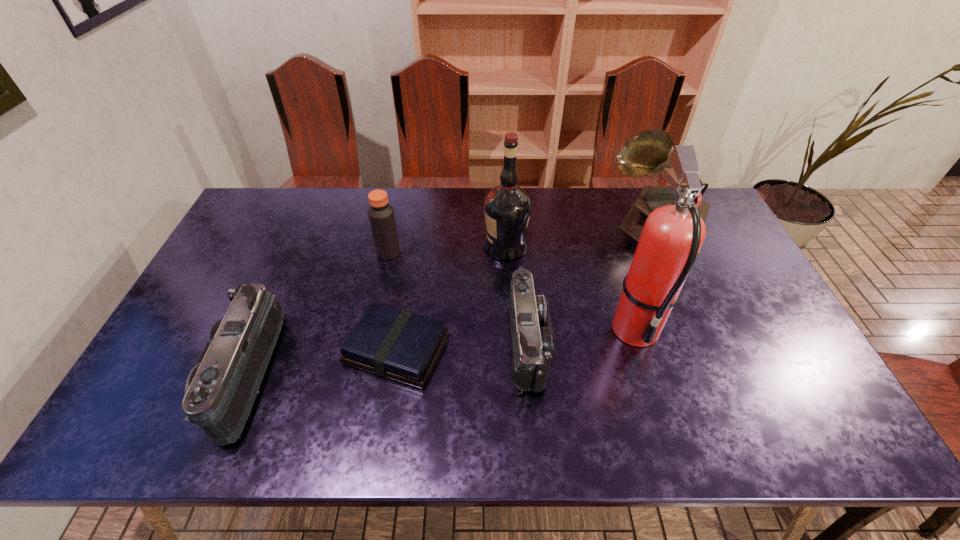
The height and width of the screenshot is (540, 960). I want to click on blank region between the liquor and the vinegar, so click(447, 249).

The width and height of the screenshot is (960, 540). In order to click on vacant space that is in between the shorter camcorder and the book in this screenshot , I will do `click(462, 347)`.

Identify the location of vacant point located between the vinegar and the taller camcorder. The image size is (960, 540). pos(318,314).

You are a GUI agent. You are given a task and a screenshot of the screen. Output one action in this format:
    pyautogui.click(x=<x>, y=<y>)
    Task: Click on the vacant space that's between the shortest object and the third shortest object
    
    Given the screenshot: What is the action you would take?
    pyautogui.click(x=322, y=362)

Locate an element on the screen. free spot between the right camcorder and the phonograph record is located at coordinates (591, 284).

The width and height of the screenshot is (960, 540). Find the location of `the second closest object relative to the phonograph record`. the second closest object relative to the phonograph record is located at coordinates (507, 207).

The height and width of the screenshot is (540, 960). What are the coordinates of `the closest object relative to the tallest object` in the screenshot? It's located at (648, 153).

Locate an element on the screen. vacant space that satisfies the following two spatial constraints: 1. on the horn direction of the phonograph record; 2. on the hose direction of the tallest object is located at coordinates (701, 327).

This screenshot has width=960, height=540. I want to click on free location that satisfies the following two spatial constraints: 1. on the front-facing side of the shorter camcorder; 2. on the front side of the book, so [x=528, y=349].

The height and width of the screenshot is (540, 960). What are the coordinates of `vacant space that satisfies the following two spatial constraints: 1. on the horn direction of the fifth shortest object; 2. on the hose direction of the tallest object` in the screenshot? It's located at 701,327.